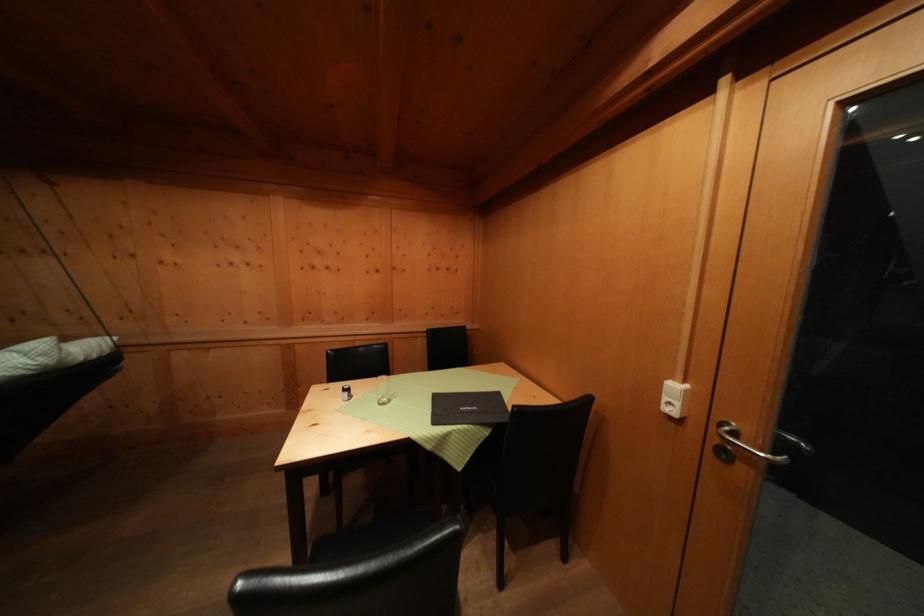
Find where to sit the chair sitting surface. Please return your answer as a coordinate pair (x, y).

(360, 539)